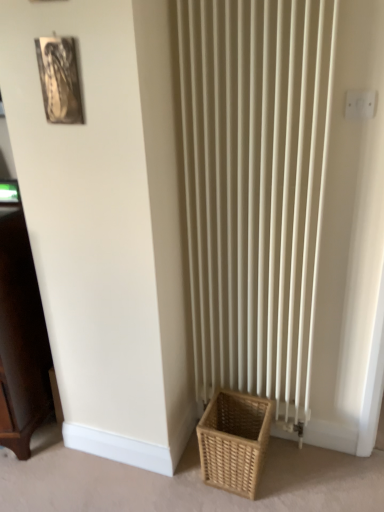
Question: Is point (235, 411) closer or farther from the camera than point (6, 276)?

Choices:
 (A) farther
 (B) closer

Answer: (A)

Question: From a real-world perspective, is natural woven basket at lower right positioned above or below dark wood cabinet at left?

Choices:
 (A) below
 (B) above

Answer: (A)

Question: Which object is positioned closest to the natural woven basket at lower right?

Choices:
 (A) dark wood cabinet at left
 (B) metallic silver picture frame at upper left
 (C) white plastic electric outlet at upper right

Answer: (A)

Question: Estimate the real-world distances between objects in this image. Which object is farther from the white plastic electric outlet at upper right?

Choices:
 (A) dark wood cabinet at left
 (B) natural woven basket at lower right
 (C) metallic silver picture frame at upper left

Answer: (A)